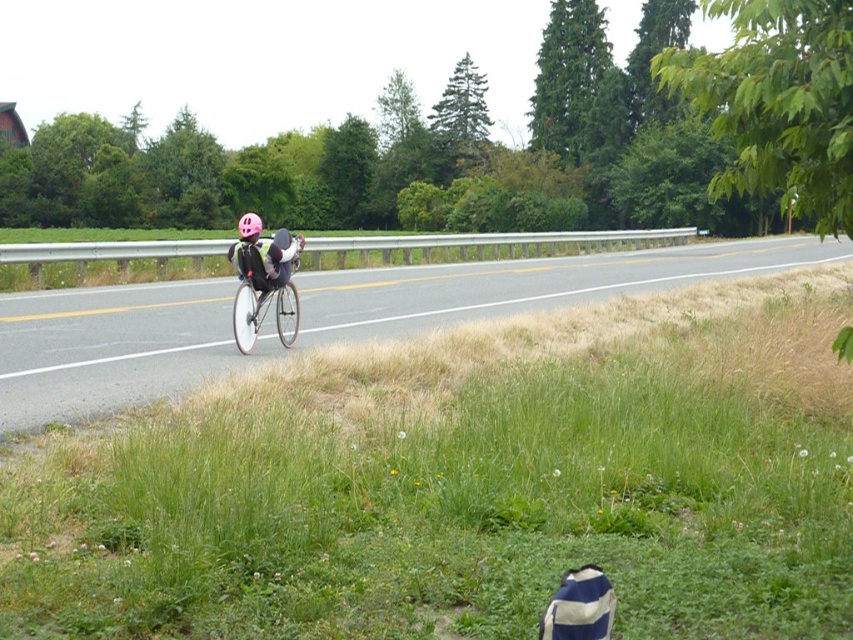
You are a drone operator trying to capture aerial footage of the asphalt road at center and the pink matte helmet at center. Based on the scene, which object would appear closer to the camera in the footage?

The pink matte helmet at center appears closer to the camera because it has a greater height than the asphalt road at center, making it rise above the road surface in the frame.

You are a pedestrian trying to cross the road. You see the asphalt road at center and the pink matte helmet at center. Which one is smaller in size?

The asphalt road at center is smaller in size compared to the pink matte helmet at center according to the description.

You are standing at the bottom right corner of the image where the striped object is located. You want to walk towards the cyclist in the middle ground. Which direction should you move first to reach the cyclist without crossing the road? Please choose between moving towards point A at coordinates point (289, 342) or point B at coordinates point (250, 236).

You should move towards point B at coordinates point (250, 236) first because it is closer to the cyclist than point A at coordinates point (289, 342). Since point A is further away from you, moving towards point B would be the shorter path towards the cyclist.